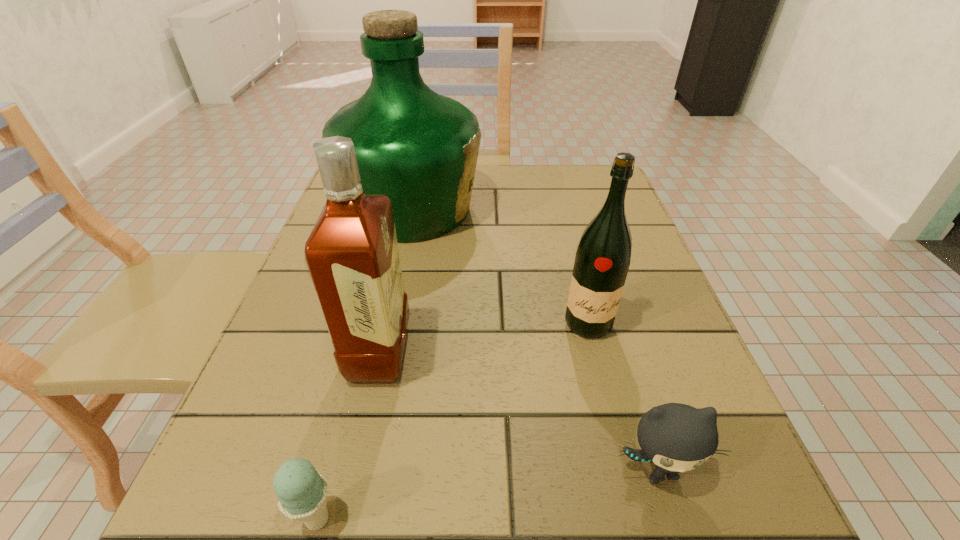
At what (x,y) coordinates should I click in order to perform the action: click on object positioned at the near right corner. Please return your answer as a coordinate pair (x, y). Looking at the image, I should click on (676, 437).

This screenshot has height=540, width=960. In the image, there is a desktop. Identify the location of free space at the far edge. (479, 167).

Where is `vacant space at the near edge of the desktop`? vacant space at the near edge of the desktop is located at coordinates 485,514.

Identify the location of vacant region at the left edge of the desktop. The height and width of the screenshot is (540, 960). (208, 466).

Where is `vacant space at the right edge of the desktop`? This screenshot has height=540, width=960. vacant space at the right edge of the desktop is located at coordinates (639, 309).

Identify the location of free space at the far right corner. (569, 208).

Find the location of a particular element. The image size is (960, 540). vacant region at the near right corner is located at coordinates (732, 530).

At what (x,y) coordinates should I click in order to perform the action: click on vacant space in between the rightmost liquor and the farthest liquor. Please return your answer as a coordinate pair (x, y). Looking at the image, I should click on (500, 267).

Image resolution: width=960 pixels, height=540 pixels. In order to click on vacant space that's between the kitten and the farthest liquor in this screenshot , I will do `click(535, 340)`.

Identify the location of object that is the fourth nearest to the kitten. This screenshot has height=540, width=960. (419, 148).